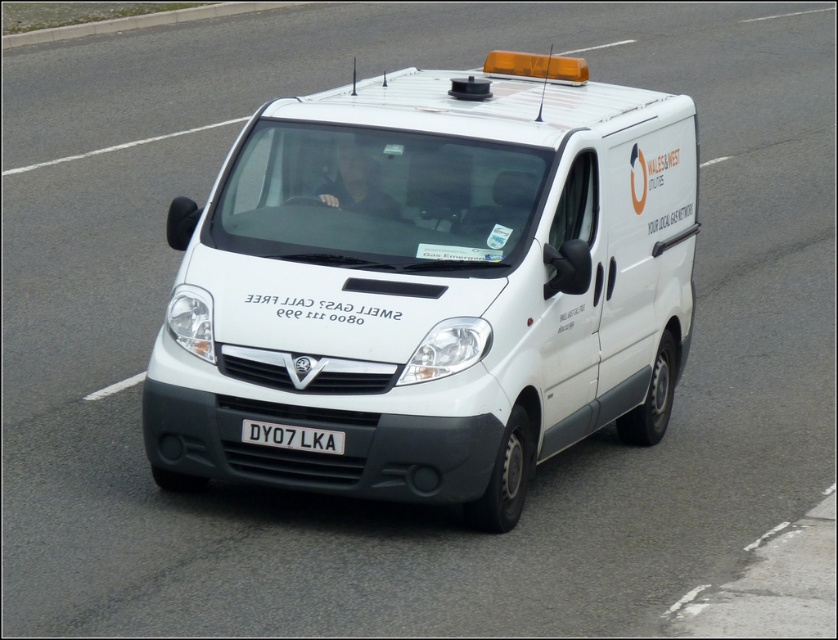
Is point (220, 253) farther from viewer compared to point (291, 428)?

That is True.

Does point (173, 316) lie in front of point (282, 428)?

That is False.

Is point (490, 404) positioned behind point (337, 429)?

Yes, it is.

Identify the location of white matte van at center. The image size is (838, 640). (432, 284).